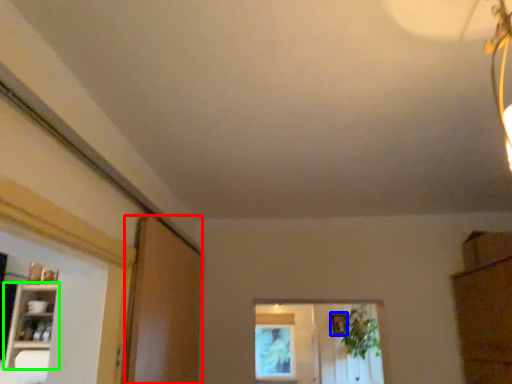
Question: Which object is the closest to the screen door (highlighted by a red box)? Choose among these: picture frame (highlighted by a blue box) or shelf (highlighted by a green box).

Choices:
 (A) picture frame
 (B) shelf

Answer: (B)